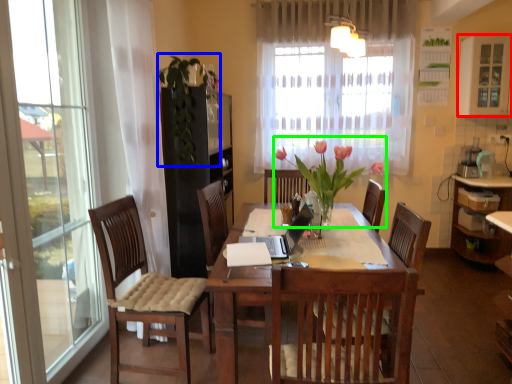
Question: Considering the real-world distances, which object is farthest from window (highlighted by a red box)? floral arrangement (highlighted by a blue box) or floral arrangement (highlighted by a green box)?

Choices:
 (A) floral arrangement
 (B) floral arrangement

Answer: (A)